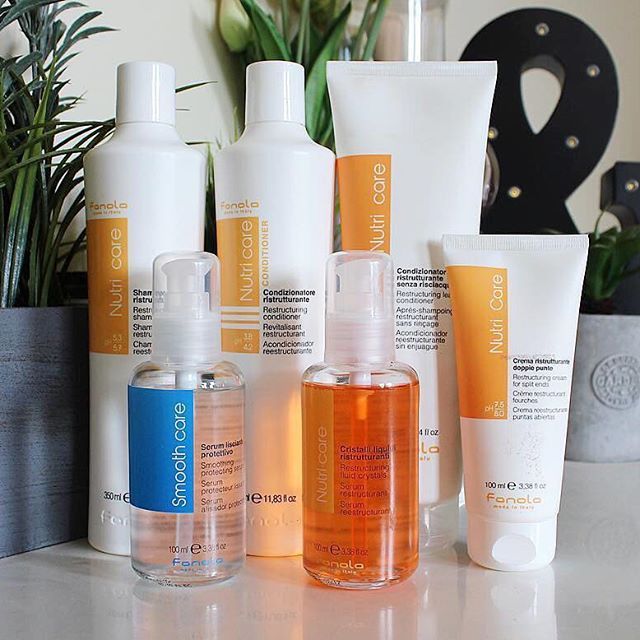
The width and height of the screenshot is (640, 640). In order to click on bottles in this screenshot , I will do `click(155, 180)`, `click(291, 178)`, `click(169, 404)`, `click(361, 412)`.